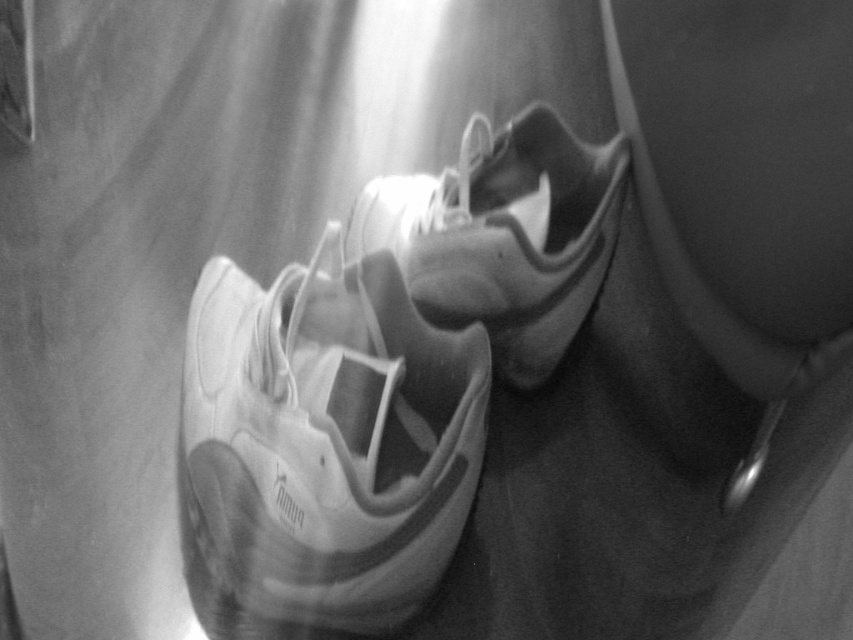
You are a photographer setting up a shoot. You need to place a 24 inch wide backdrop behind the white matte shoe at center. Will the backdrop be large enough to cover the entire shoe?

The white matte shoe at center is 30.41 inches from camera. The distance does not affect the backdrop width requirement. The 24 inch wide backdrop may not be sufficient if the shoe is wider than 24 inches. However, the description only provides distance, not width. Therefore, it is impossible to determine if the backdrop is large enough based on the given information.

You are a delivery person who needs to ensure that both the white matte shoe at center and the white matte sneaker at center fit into a delivery box that can only accommodate items up to the size of the larger one. Which item determines the minimum required box size?

The white matte shoe at center is larger in size than the white matte sneaker at center, so the box must be sized to accommodate the white matte shoe at center.